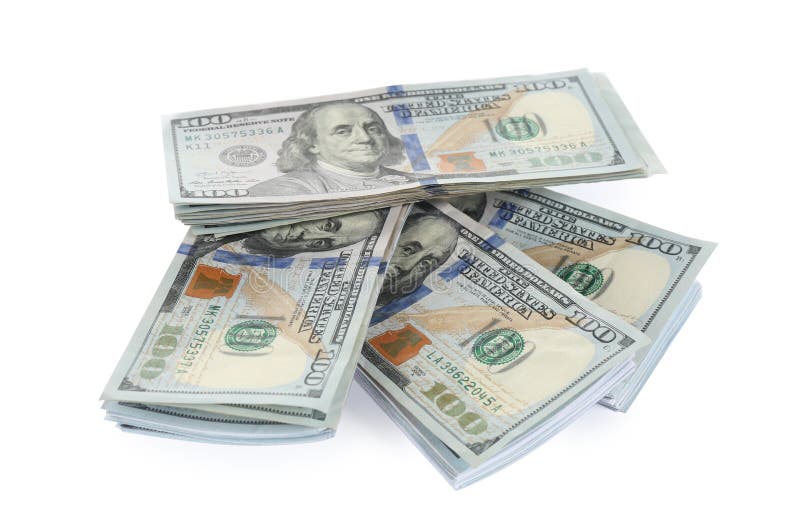
This screenshot has width=800, height=531. Identify the location of picture of benjami franklin. coord(334,135), coord(316,231), coord(421,250), coord(474,199).